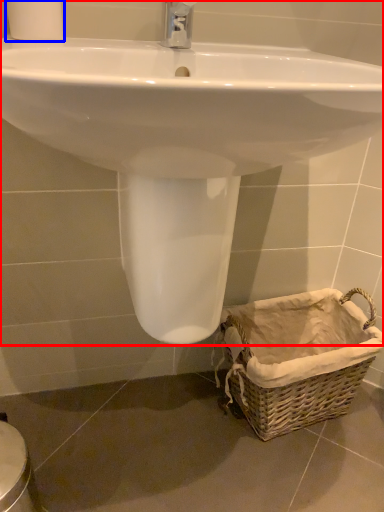
Question: Which object is closer to the camera taking this photo, sink (highlighted by a red box) or toilet paper (highlighted by a blue box)?

Choices:
 (A) sink
 (B) toilet paper

Answer: (A)